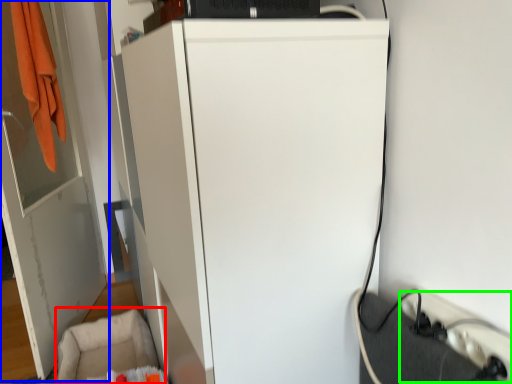
Question: Which is nearer to the swivel chair (highlighted by a red box)? door (highlighted by a blue box) or extension cord (highlighted by a green box).

Choices:
 (A) door
 (B) extension cord

Answer: (A)